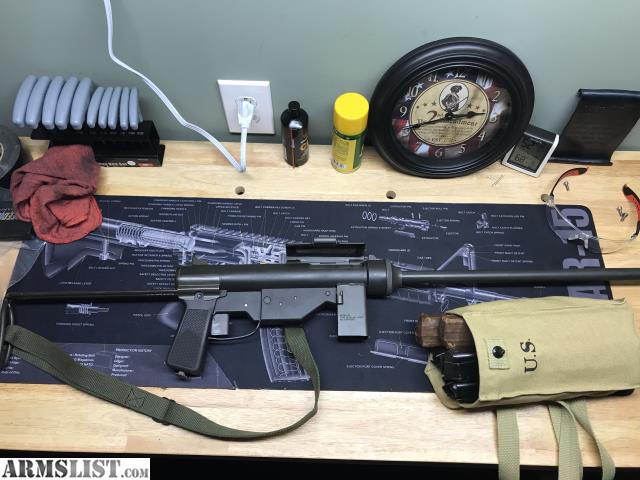
Image resolution: width=640 pixels, height=480 pixels. What are the coordinates of `picture` in the screenshot? It's located at (456, 86).